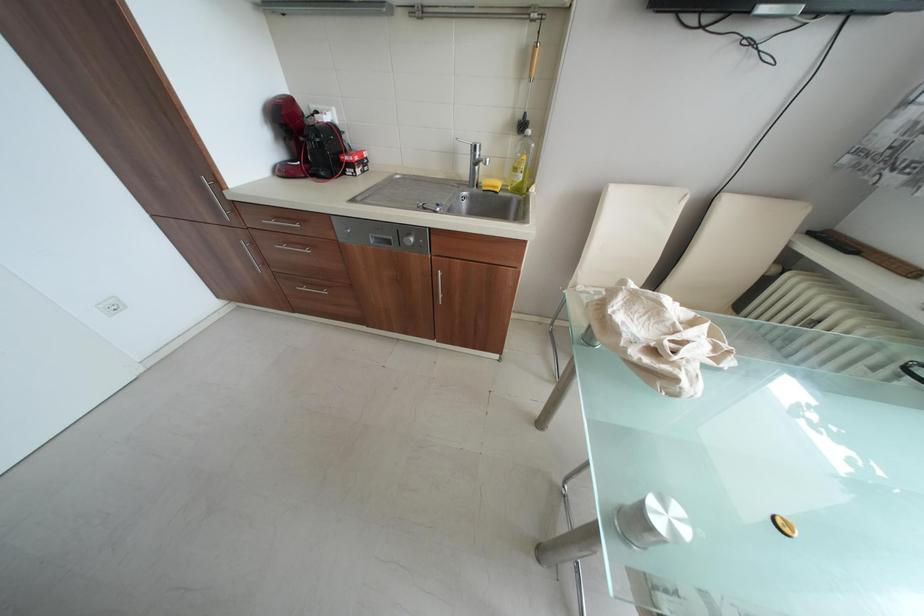
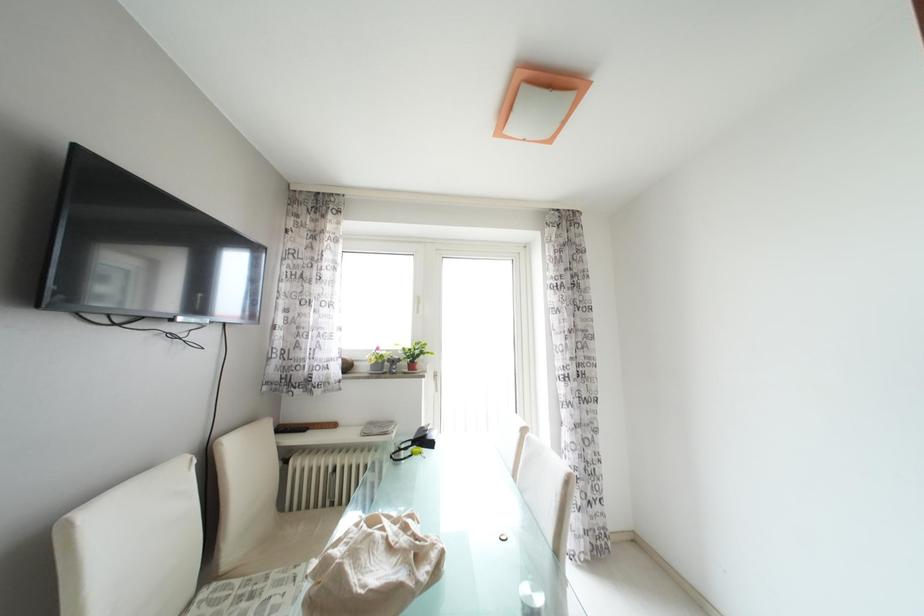
Question: How did the camera likely rotate?

Choices:
 (A) Left
 (B) Right
 (C) Up
 (D) Down

Answer: (B)